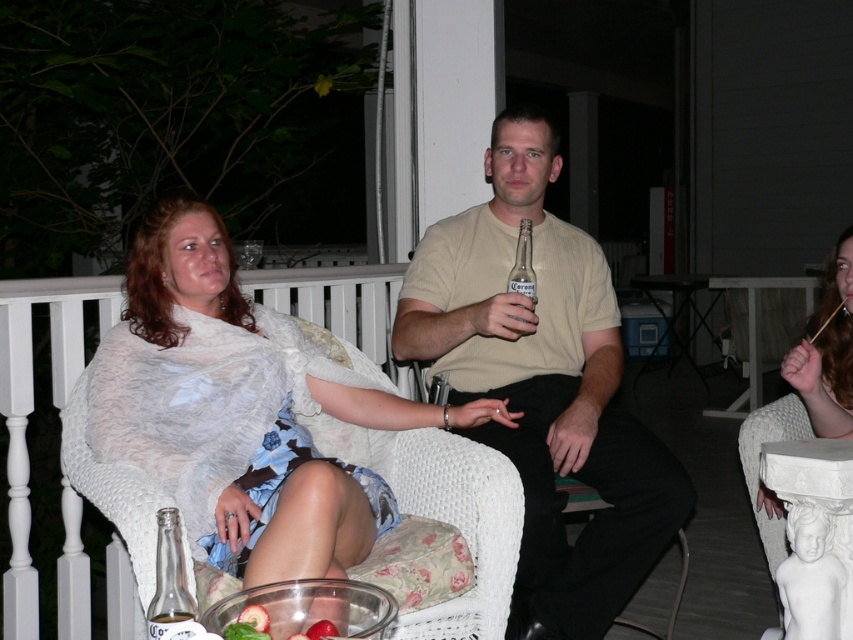
Question: Among these objects, which one is nearest to the camera?

Choices:
 (A) white sheer fabric at left
 (B) clear glass bottle at lower left
 (C) beige cotton shirt at center
 (D) translucent glass bottle at lower left

Answer: (B)

Question: Which point is farther from the camera taking this photo?

Choices:
 (A) (161, 596)
 (B) (555, 323)

Answer: (B)

Question: Can you confirm if white sheer fabric at left is thinner than clear glass bottle at lower left?

Choices:
 (A) no
 (B) yes

Answer: (A)

Question: Can you confirm if white sheer fabric at left is positioned below clear glass beer bottle at center?

Choices:
 (A) yes
 (B) no

Answer: (A)

Question: Does clear glass bottle at lower left appear on the right side of translucent glass bottle at lower left?

Choices:
 (A) no
 (B) yes

Answer: (A)

Question: Which object is the farthest from the white sheer fabric at left?

Choices:
 (A) clear glass bottle at lower left
 (B) clear glass beer bottle at center

Answer: (A)